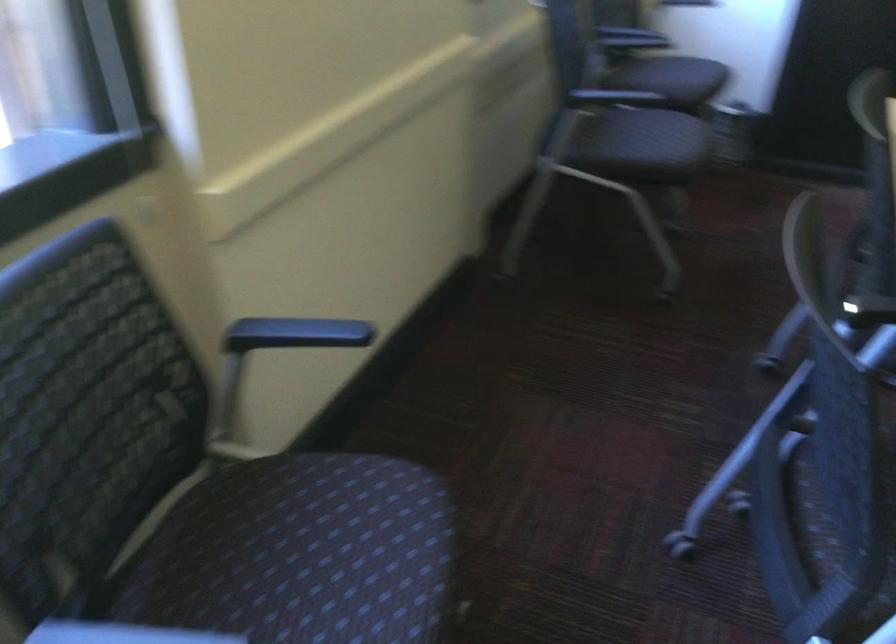
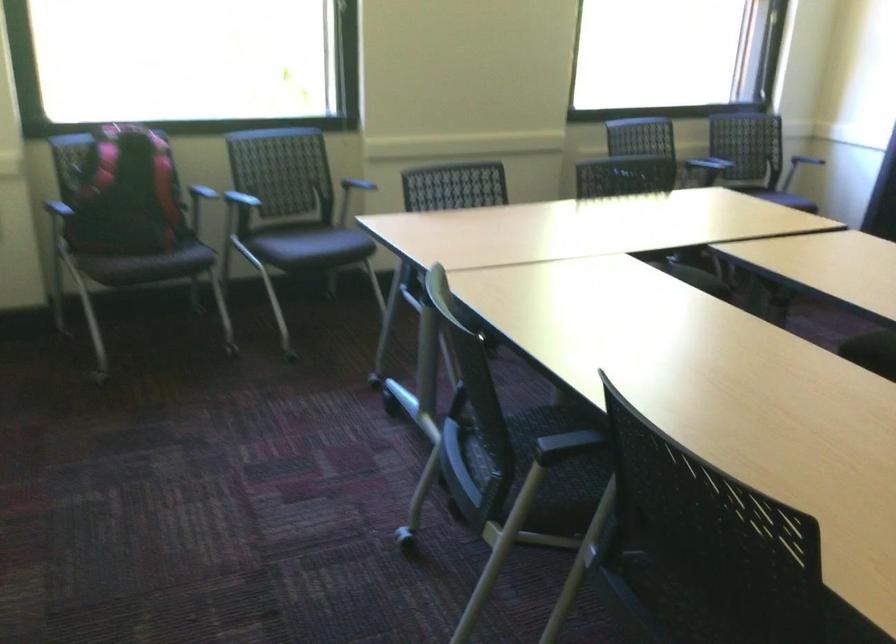
The point at [399,562] is marked in the first image. Where is the corresponding point in the second image?

(323, 243)